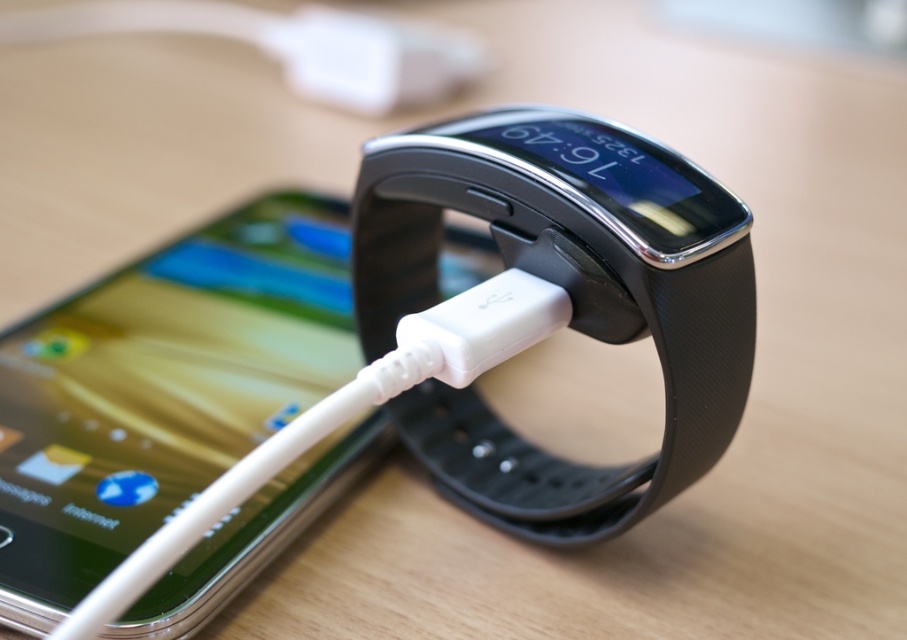
Question: In this image, where is black rubber watch at center located relative to white plastic usb cable at center?

Choices:
 (A) above
 (B) below

Answer: (A)

Question: Is black rubber watch at center to the right of white plastic usb cable at center from the viewer's perspective?

Choices:
 (A) yes
 (B) no

Answer: (A)

Question: Does black rubber watch at center have a larger size compared to white plastic usb cable at center?

Choices:
 (A) no
 (B) yes

Answer: (B)

Question: Which of the following is the farthest from the observer?

Choices:
 (A) (562, 493)
 (B) (505, 355)

Answer: (A)